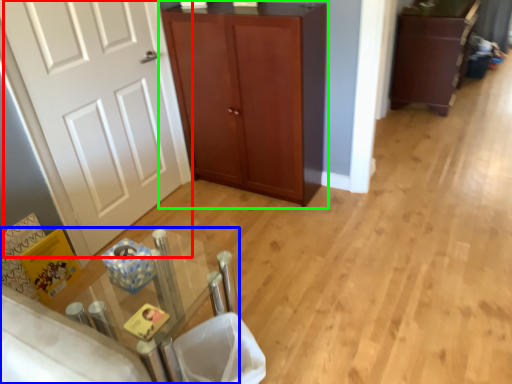
Question: Estimate the real-world distances between objects in this image. Which object is farther from door (highlighted by a red box), table (highlighted by a blue box) or cupboard (highlighted by a green box)?

Choices:
 (A) table
 (B) cupboard

Answer: (A)